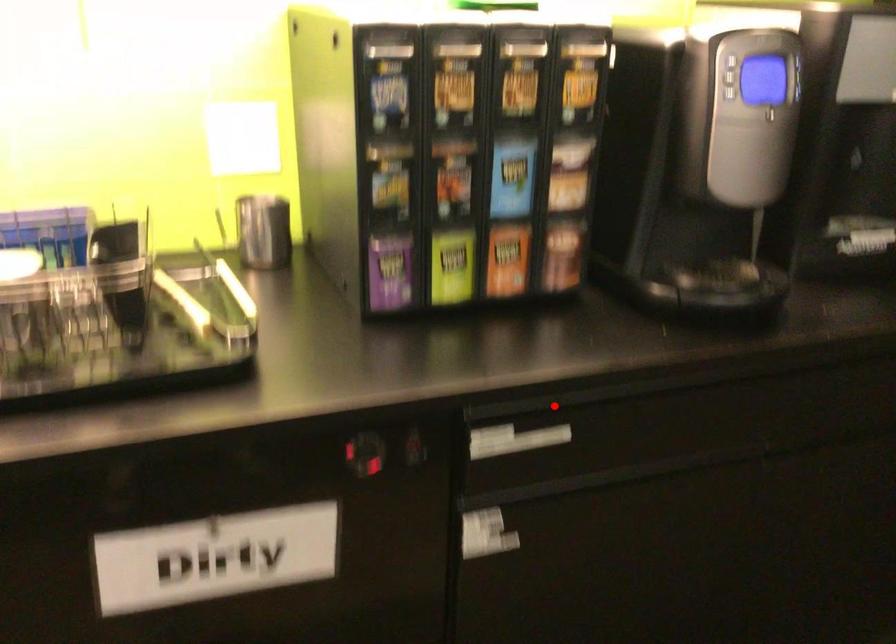
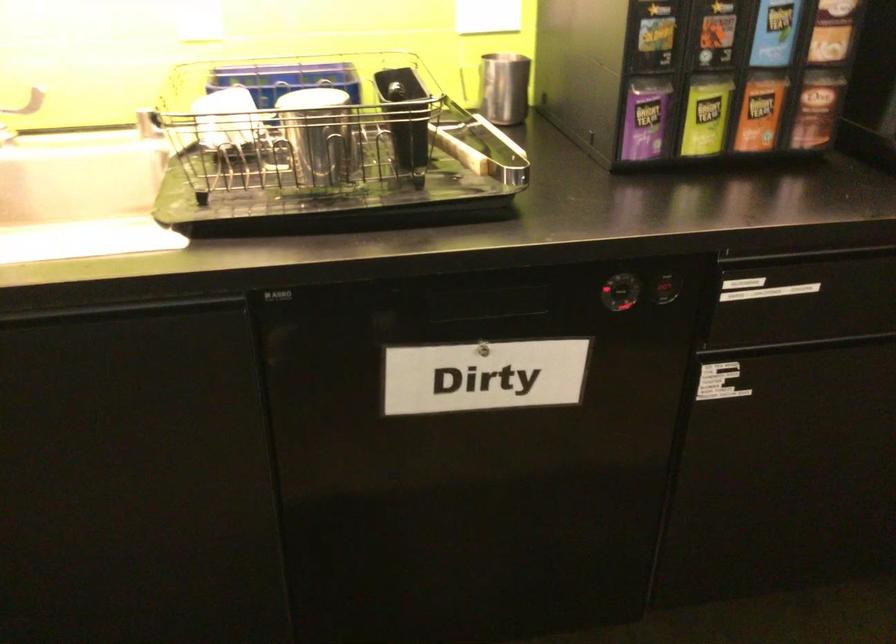
The point at the highlighted location is marked in the first image. Where is the corresponding point in the second image?

(807, 254)